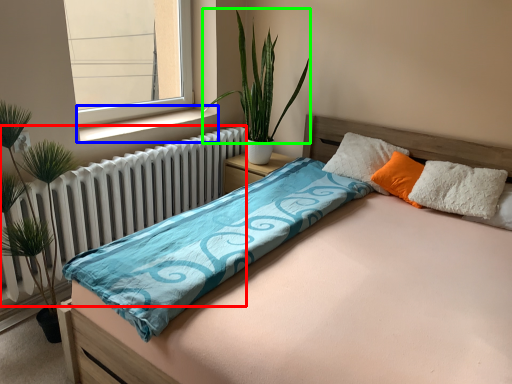
Question: Which is nearer to the radiator (highlighted by a red box)? window sill (highlighted by a blue box) or vegetation (highlighted by a green box).

Choices:
 (A) window sill
 (B) vegetation

Answer: (A)